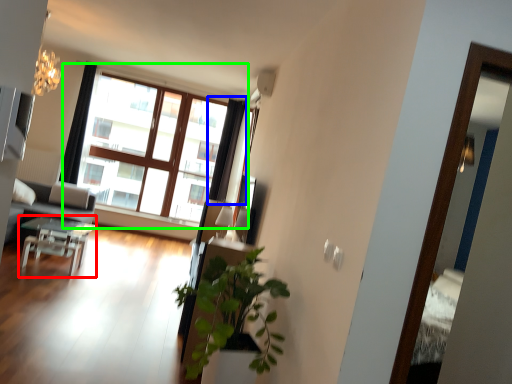
Question: Which object is positioned closest to table (highlighted by a red box)? Select from curtain (highlighted by a blue box) and window (highlighted by a green box).

Choices:
 (A) curtain
 (B) window

Answer: (B)